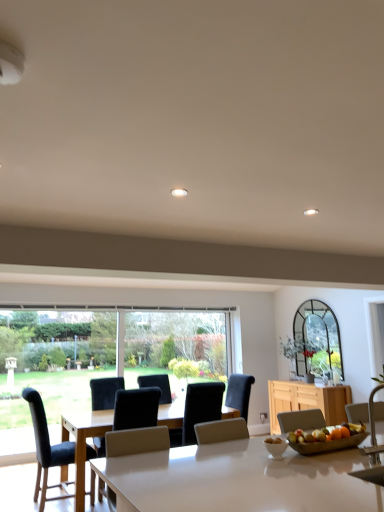
Question: Should I look upward or downward to see black leather chair at left, which appears as the 4th chair when viewed from the right?

Choices:
 (A) down
 (B) up

Answer: (A)

Question: Would you say metallic silver chair at right, the fourth chair when ordered from left to right, is outside white glossy bowl at center?

Choices:
 (A) yes
 (B) no

Answer: (A)

Question: Can you confirm if metallic silver chair at right, which appears as the 1th chair when viewed from the front, is taller than white glossy bowl at center?

Choices:
 (A) yes
 (B) no

Answer: (A)

Question: Does metallic silver chair at right, which appears as the 1th chair when viewed from the front, have a smaller size compared to white glossy bowl at center?

Choices:
 (A) yes
 (B) no

Answer: (B)

Question: Does metallic silver chair at right, the fourth chair when ordered from left to right, have a larger size compared to white glossy bowl at center?

Choices:
 (A) yes
 (B) no

Answer: (A)

Question: Would you consider metallic silver chair at right, the fourth chair when ordered from left to right, to be distant from white glossy bowl at center?

Choices:
 (A) yes
 (B) no

Answer: (B)

Question: Is metallic silver chair at right, which is the first chair in right-to-left order, to the left of white glossy bowl at center from the viewer's perspective?

Choices:
 (A) no
 (B) yes

Answer: (A)

Question: Is metallic silver chair at right, the fourth chair positioned from the back, at the back of white glossy bowl at center?

Choices:
 (A) yes
 (B) no

Answer: (B)

Question: Can you confirm if white glossy bowl at center is shorter than metallic silver chair at right, which is the first chair in right-to-left order?

Choices:
 (A) yes
 (B) no

Answer: (A)

Question: Is white glossy bowl at center smaller than metallic silver chair at right, which is the first chair in right-to-left order?

Choices:
 (A) yes
 (B) no

Answer: (A)

Question: Is white glossy bowl at center located outside metallic silver chair at right, the fourth chair positioned from the back?

Choices:
 (A) no
 (B) yes

Answer: (B)

Question: From a real-world perspective, does white glossy bowl at center sit lower than metallic silver chair at right, which appears as the 1th chair when viewed from the front?

Choices:
 (A) no
 (B) yes

Answer: (B)

Question: From the image's perspective, is white glossy bowl at center above metallic silver chair at right, the fourth chair when ordered from left to right?

Choices:
 (A) no
 (B) yes

Answer: (A)

Question: From the image's perspective, is white glossy table at center located beneath white glossy bowl at center?

Choices:
 (A) yes
 (B) no

Answer: (A)